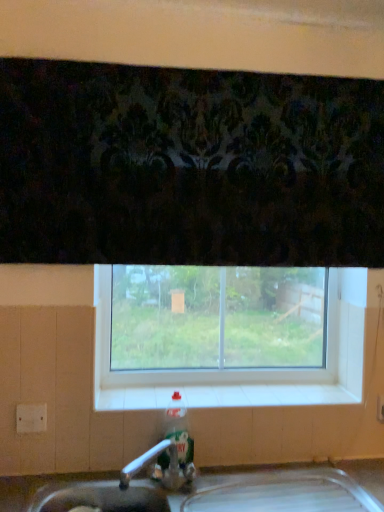
Question: Is clear glass window at center wider or thinner than white tile at center?

Choices:
 (A) wide
 (B) thin

Answer: (B)

Question: From a real-world perspective, relative to white tile at center, is clear glass window at center vertically above or below?

Choices:
 (A) below
 (B) above

Answer: (B)

Question: Estimate the real-world distances between objects in this image. Which object is closer to the white tile at center?

Choices:
 (A) translucent plastic bottle at sink
 (B) clear glass window at center

Answer: (B)

Question: Which object is positioned closest to the translucent plastic bottle at sink?

Choices:
 (A) clear glass window at center
 (B) white tile at center

Answer: (B)